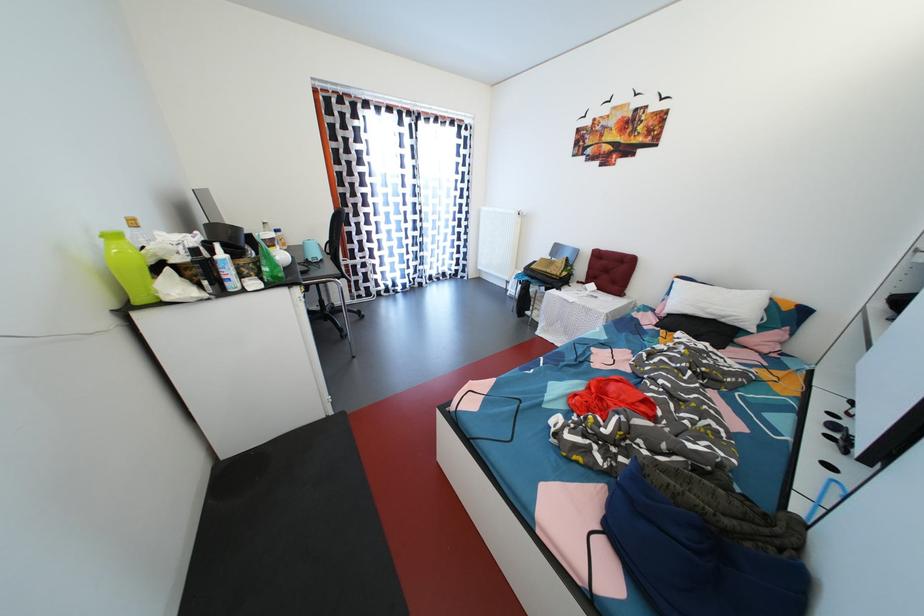
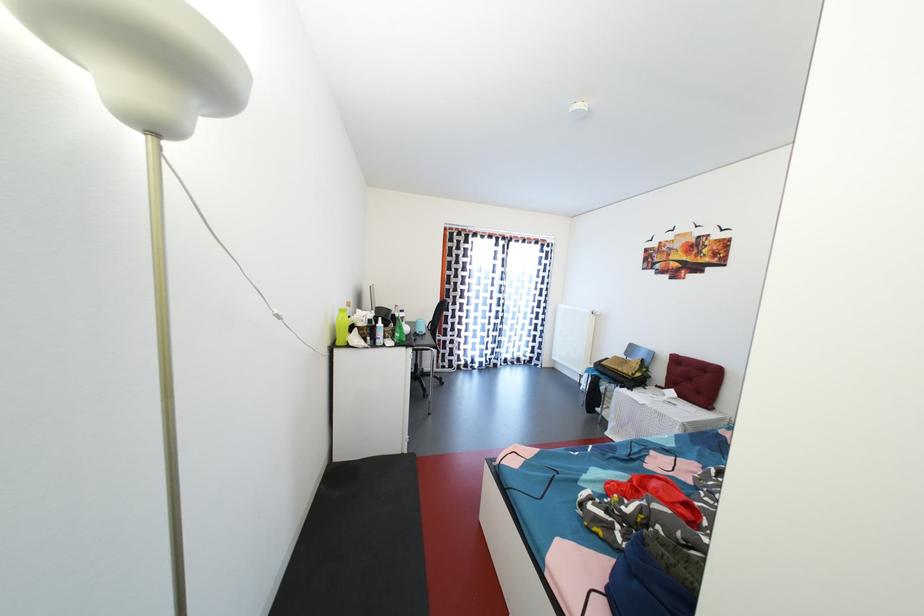
The point at (610, 253) is marked in the first image. Where is the corresponding point in the second image?

(688, 359)